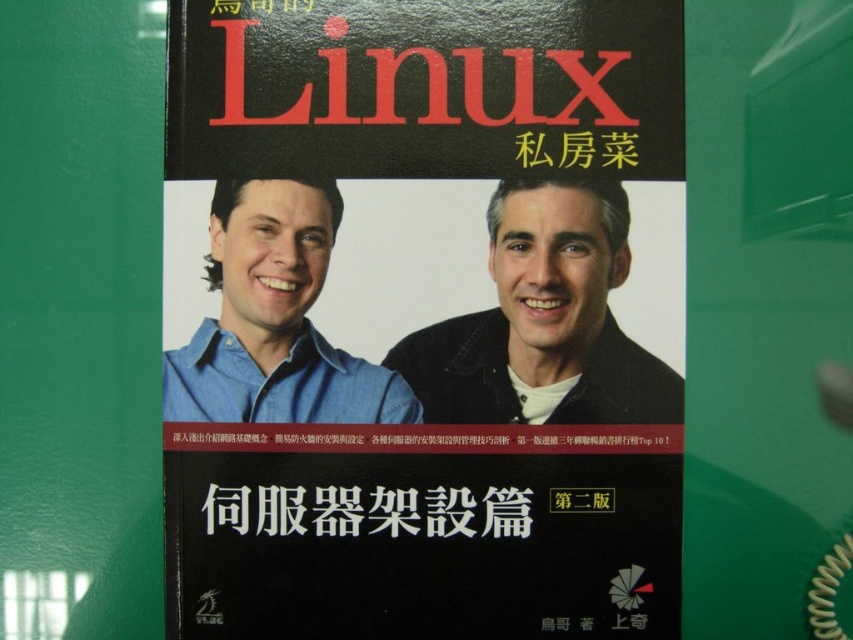
Question: Based on their relative distances, which object is farther from the blue denim shirt at left?

Choices:
 (A) black matte text at center
 (B) black matte book cover at center
 (C) matte black shirt at center

Answer: (C)

Question: Does blue denim shirt at left appear on the right side of black matte text at center?

Choices:
 (A) no
 (B) yes

Answer: (A)

Question: Can you confirm if black matte book cover at center is positioned to the right of black matte text at center?

Choices:
 (A) no
 (B) yes

Answer: (B)

Question: Which object is positioned farthest from the black matte book cover at center?

Choices:
 (A) matte black shirt at center
 (B) blue denim shirt at left
 (C) black matte text at center

Answer: (C)

Question: Is black matte book cover at center closer to the viewer compared to blue denim shirt at left?

Choices:
 (A) yes
 (B) no

Answer: (A)

Question: Among these objects, which one is farthest from the camera?

Choices:
 (A) blue denim shirt at left
 (B) matte black shirt at center

Answer: (B)